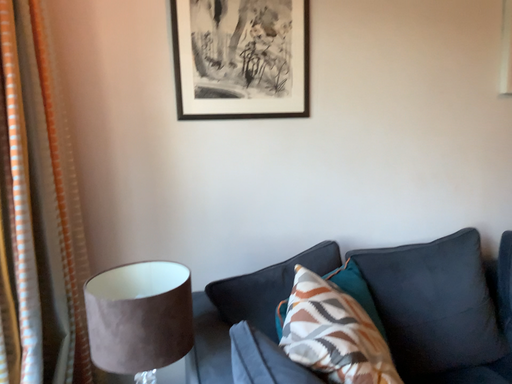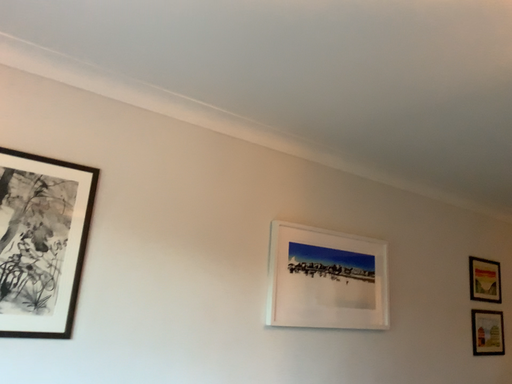
Question: Which way did the camera rotate in the video?

Choices:
 (A) rotated left
 (B) rotated right

Answer: (B)